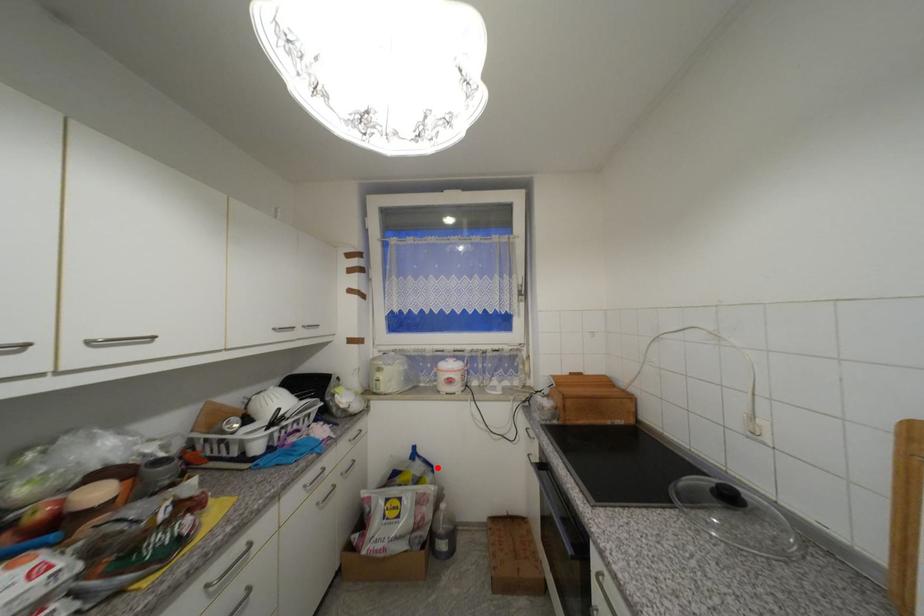
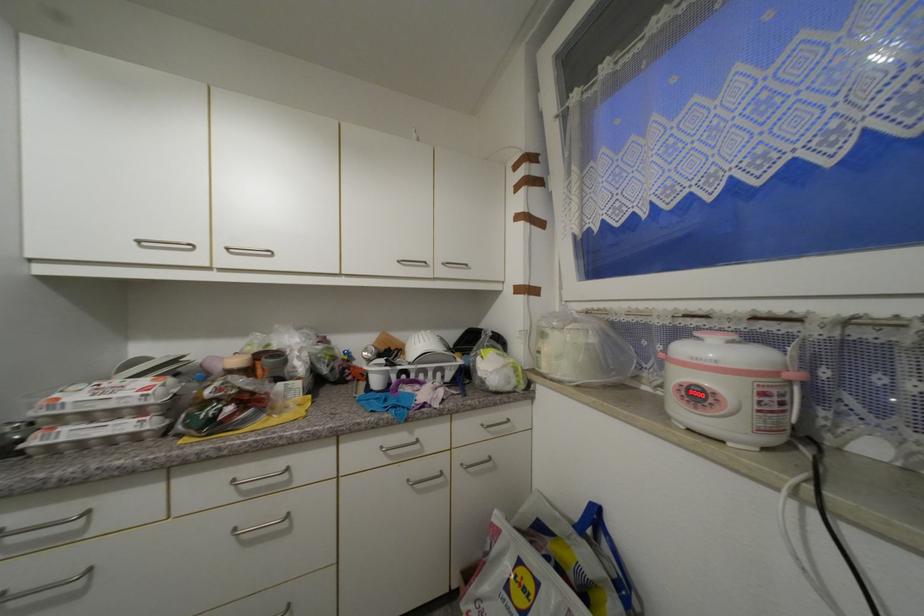
In the second image, find the point that corresponds to the highlighted location in the first image.

(636, 588)